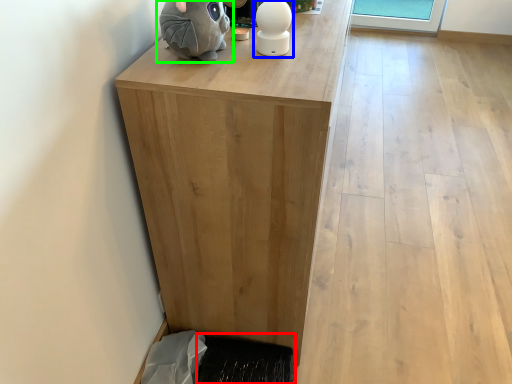
Question: Estimate the real-world distances between objects in this image. Which object is farther from doormat (highlighted by a red box), figurine (highlighted by a blue box) or toy (highlighted by a green box)?

Choices:
 (A) figurine
 (B) toy

Answer: (B)